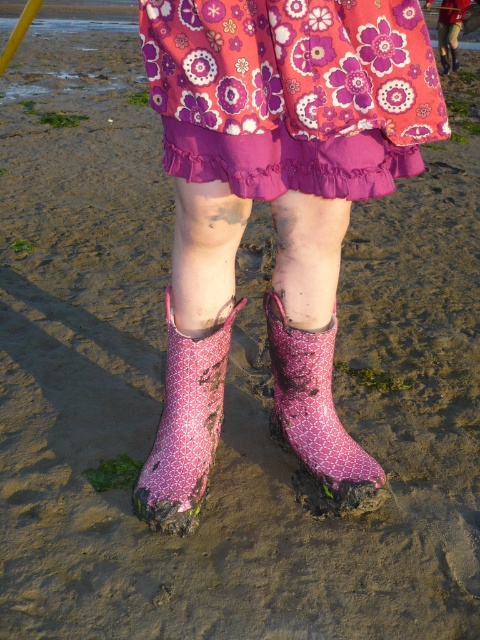
Is pink floral fabric skirt at upper center positioned at the back of pink fabric boot at lower center?

No, it is not.

Who is higher up, pink floral fabric skirt at upper center or pink fabric boot at lower center?

pink floral fabric skirt at upper center

Which is behind, point (250, 65) or point (151, 474)?

Positioned behind is point (151, 474).

You are a GUI agent. You are given a task and a screenshot of the screen. Output one action in this format:
    pyautogui.click(x=<x>, y=<y>)
    Task: Click on the pink floral fabric skirt at upper center
    Image resolution: width=480 pixels, height=640 pixels.
    Given the screenshot: What is the action you would take?
    pyautogui.click(x=292, y=92)

Does pink rubber boots at center appear under pink rubber boot at lower center?

Incorrect, pink rubber boots at center is not positioned below pink rubber boot at lower center.

Is pink rubber boots at center to the left of pink rubber boot at lower center from the viewer's perspective?

Indeed, pink rubber boots at center is positioned on the left side of pink rubber boot at lower center.

Who is more distant from viewer, [156,490] or [310,465]?

The point [310,465] is more distant.

In order to click on pink rubber boots at center in this screenshot , I will do `click(273, 204)`.

How distant is pink floral fabric skirt at upper center from pink rubber boot at lower center?

They are 23.91 inches apart.

What do you see at coordinates (292, 92) in the screenshot? The image size is (480, 640). I see `pink floral fabric skirt at upper center` at bounding box center [292, 92].

Who is more forward, (382,20) or (310,333)?

Point (382,20) is in front.

At what (x,y) coordinates should I click in order to perform the action: click on pink floral fabric skirt at upper center. Please return your answer as a coordinate pair (x, y). Looking at the image, I should click on (292, 92).